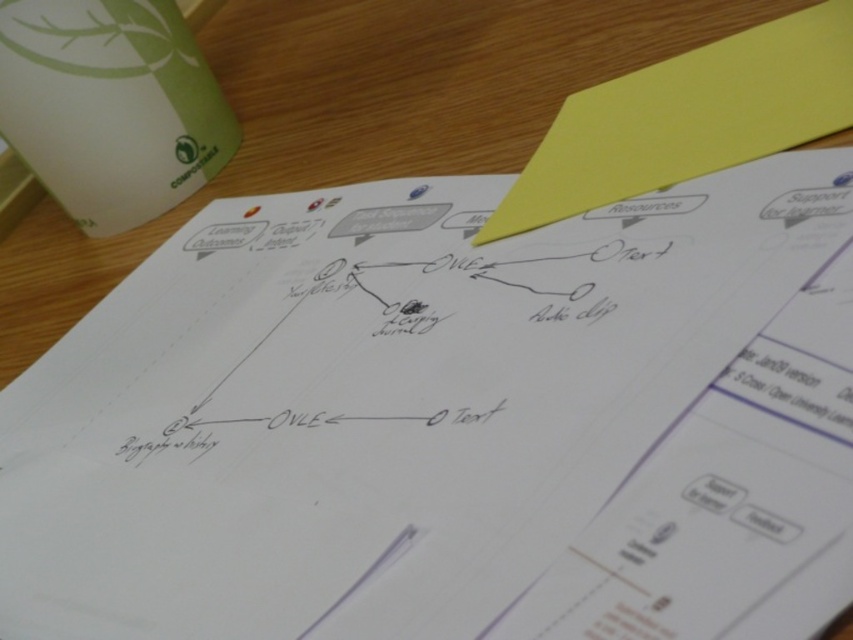
Question: Which point is closer to the camera?

Choices:
 (A) (625, 125)
 (B) (194, 65)

Answer: (A)

Question: Which of the following is the farthest from the observer?

Choices:
 (A) (48, 106)
 (B) (820, 125)

Answer: (A)

Question: Is green matte cup at upper left in front of yellow paper at upper right?

Choices:
 (A) yes
 (B) no

Answer: (B)

Question: Does green matte cup at upper left have a greater width compared to yellow paper at upper right?

Choices:
 (A) yes
 (B) no

Answer: (B)

Question: In this image, where is green matte cup at upper left located relative to yellow paper at upper right?

Choices:
 (A) above
 (B) below

Answer: (A)